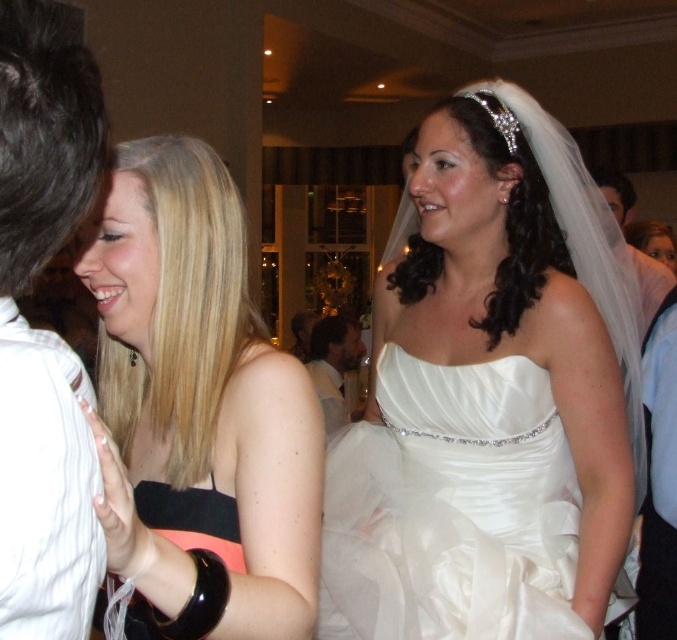
Question: Does white striped shirt at left appear on the right side of dark brown hair at center?

Choices:
 (A) yes
 (B) no

Answer: (B)

Question: Among these objects, which one is farthest from the camera?

Choices:
 (A) black satin dress at left
 (B) white striped shirt at left

Answer: (A)

Question: Estimate the real-world distances between objects in this image. Which object is farther from the white satin suit at upper right?

Choices:
 (A) dark brown hair at center
 (B) black satin dress at left

Answer: (A)

Question: Which of the following is the farthest from the observer?

Choices:
 (A) 336,353
 (B) 336,614
 (C) 611,205
 (D) 39,412

Answer: (A)

Question: Can you confirm if black satin dress at left is bigger than white satin suit at upper right?

Choices:
 (A) no
 (B) yes

Answer: (A)

Question: Can you confirm if dark brown hair at center is positioned to the right of white satin suit at upper right?

Choices:
 (A) yes
 (B) no

Answer: (B)